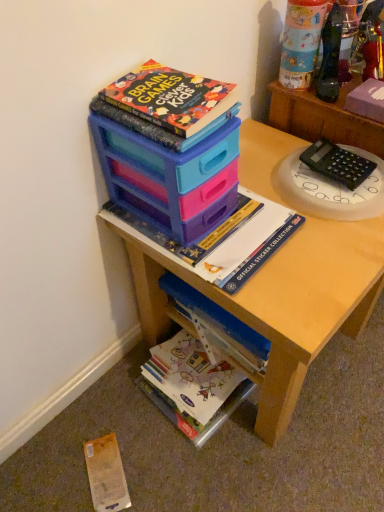
Locate an element on the screen. The width and height of the screenshot is (384, 512). blank area to the left of yellow paper at lower left is located at coordinates (46, 468).